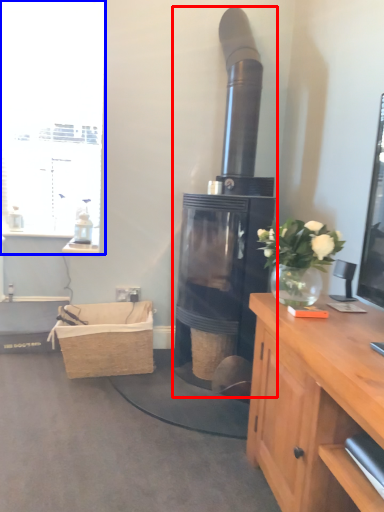
Question: Among these objects, which one is farthest to the camera, fireplace (highlighted by a red box) or window (highlighted by a blue box)?

Choices:
 (A) fireplace
 (B) window

Answer: (B)